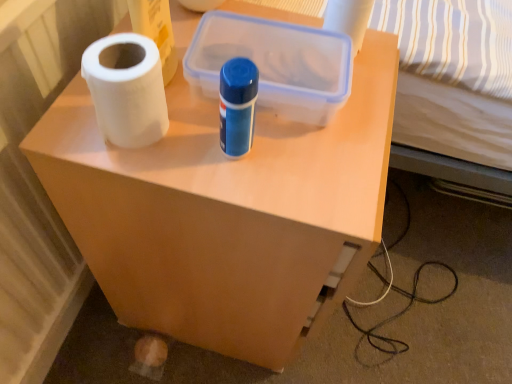
Locate an element on the screen. The height and width of the screenshot is (384, 512). transparent plastic storage box at center is located at coordinates (275, 64).

Consider the image. Measure the distance between matte plastic side table at center and camera.

matte plastic side table at center and camera are 18.47 inches apart.

The width and height of the screenshot is (512, 384). In order to click on white matte paper towel at left in this screenshot , I will do `click(126, 89)`.

What do you see at coordinates (126, 89) in the screenshot?
I see `white matte paper towel at left` at bounding box center [126, 89].

Find the location of `transparent plastic storage box at center`. transparent plastic storage box at center is located at coordinates (275, 64).

Is matte plastic side table at center at the back of white matte toilet paper at upper center?

white matte toilet paper at upper center does not have its back to matte plastic side table at center.

Based on their sizes in the image, would you say white matte toilet paper at upper center is bigger or smaller than matte plastic side table at center?

Considering their sizes, white matte toilet paper at upper center takes up less space than matte plastic side table at center.

Considering the positions of objects white matte toilet paper at upper center and matte plastic side table at center in the image provided, who is behind, white matte toilet paper at upper center or matte plastic side table at center?

white matte toilet paper at upper center is more distant.

Between point (354, 27) and point (359, 105), which one is positioned in front?

The point (359, 105) is closer.

From the image's perspective, would you say white matte paper towel at left is shown under white matte toilet paper at upper center?

Correct, white matte paper towel at left appears lower than white matte toilet paper at upper center in the image.

Could you tell me if white matte paper towel at left is turned towards white matte toilet paper at upper center?

No, white matte paper towel at left is not turned towards white matte toilet paper at upper center.

Between white matte paper towel at left and white matte toilet paper at upper center, which one has larger width?

Wider between the two is white matte paper towel at left.

How many degrees apart are the facing directions of white matte paper towel at left and white matte toilet paper at upper center?

white matte paper towel at left and white matte toilet paper at upper center are facing 0.00493 degrees away from each other.

Where is `storage box located above the white matte paper towel at left (from the image's perspective)`? This screenshot has height=384, width=512. storage box located above the white matte paper towel at left (from the image's perspective) is located at coordinates click(x=275, y=64).

Is transparent plastic storage box at center aimed at white matte paper towel at left?

No, transparent plastic storage box at center is not facing towards white matte paper towel at left.

Between transparent plastic storage box at center and white matte paper towel at left, which one appears on the right side from the viewer's perspective?

From the viewer's perspective, transparent plastic storage box at center appears more on the right side.

Is transparent plastic storage box at center in front of or behind white matte paper towel at left in the image?

Clearly, transparent plastic storage box at center is behind white matte paper towel at left.

From the image's perspective, is white matte paper towel at left positioned above or below transparent plastic storage box at center?

white matte paper towel at left is situated lower than transparent plastic storage box at center in the image.

Looking at this image, considering the sizes of white matte paper towel at left and transparent plastic storage box at center in the image, is white matte paper towel at left bigger or smaller than transparent plastic storage box at center?

Clearly, white matte paper towel at left is smaller in size than transparent plastic storage box at center.

Considering the points (111, 125) and (306, 89), which point is behind, point (111, 125) or point (306, 89)?

The point (306, 89) is farther.

Who is shorter, white matte paper towel at left or matte plastic side table at center?

white matte paper towel at left is shorter.

From a real-world perspective, who is located higher, white matte paper towel at left or matte plastic side table at center?

white matte paper towel at left, from a real-world perspective.

Does point (154, 56) lie in front of point (145, 274)?

Yes, point (154, 56) is closer to viewer.

From the image's perspective, which object appears higher, white matte paper towel at left or matte plastic side table at center?

From the image's view, white matte paper towel at left is above.

Which is more to the left, transparent plastic storage box at center or white matte toilet paper at upper center?

From the viewer's perspective, transparent plastic storage box at center appears more on the left side.

Which is nearer, (326, 56) or (327, 4)?

Point (326, 56) appears to be closer to the viewer than point (327, 4).

Could you measure the distance between transparent plastic storage box at center and white matte toilet paper at upper center?

The distance of transparent plastic storage box at center from white matte toilet paper at upper center is 10.78 centimeters.

What's the angular difference between transparent plastic storage box at center and white matte toilet paper at upper center's facing directions?

transparent plastic storage box at center and white matte toilet paper at upper center are facing 6.05 degrees away from each other.

From a real-world perspective, is matte plastic side table at center physically below white matte paper towel at left?

Indeed, from a real-world perspective, matte plastic side table at center is positioned beneath white matte paper towel at left.

Is white matte paper towel at left located within matte plastic side table at center?

No, white matte paper towel at left is located outside of matte plastic side table at center.

Between matte plastic side table at center and white matte paper towel at left, which one has smaller width?

white matte paper towel at left.

From the image's perspective, which one is positioned lower, matte plastic side table at center or white matte paper towel at left?

matte plastic side table at center is shown below in the image.

At what (x,y) coordinates should I click in order to perform the action: click on toilet paper that is above the matte plastic side table at center (from the image's perspective). Please return your answer as a coordinate pair (x, y). The image size is (512, 384). Looking at the image, I should click on (348, 19).

Where is `toilet paper located behind the white matte paper towel at left`? The width and height of the screenshot is (512, 384). toilet paper located behind the white matte paper towel at left is located at coordinates (348, 19).

In the scene shown: When comparing their distances from matte plastic side table at center, does transparent plastic storage box at center or white matte paper towel at left seem closer?

Among the two, transparent plastic storage box at center is located nearer to matte plastic side table at center.

When comparing their distances from matte plastic side table at center, does transparent plastic storage box at center or white matte toilet paper at upper center seem further?

Among the two, white matte toilet paper at upper center is located further to matte plastic side table at center.

From the image, which object appears to be nearer to transparent plastic storage box at center, white matte paper towel at left or white matte toilet paper at upper center?

white matte toilet paper at upper center is positioned closer to the anchor transparent plastic storage box at center.

Consider the image. Which object lies nearer to the anchor point white matte toilet paper at upper center, transparent plastic storage box at center or matte plastic side table at center?

transparent plastic storage box at center is positioned closer to the anchor white matte toilet paper at upper center.

Considering their positions, is white matte paper towel at left positioned further to matte plastic side table at center than white matte toilet paper at upper center?

white matte toilet paper at upper center lies further to matte plastic side table at center than the other object.

Which object lies nearer to the anchor point matte plastic side table at center, white matte toilet paper at upper center or white matte paper towel at left?

Based on the image, white matte paper towel at left appears to be nearer to matte plastic side table at center.

Which object lies further to the anchor point transparent plastic storage box at center, white matte toilet paper at upper center or white matte paper towel at left?

white matte paper towel at left is further to transparent plastic storage box at center.

When comparing their distances from white matte paper towel at left, does matte plastic side table at center or white matte toilet paper at upper center seem further?

Based on the image, white matte toilet paper at upper center appears to be further to white matte paper towel at left.

Identify the location of paper towel between transparent plastic storage box at center and matte plastic side table at center from top to bottom. The image size is (512, 384). (126, 89).

The height and width of the screenshot is (384, 512). Identify the location of storage box between white matte paper towel at left and white matte toilet paper at upper center. (275, 64).

The height and width of the screenshot is (384, 512). Find the location of `paper towel that lies between white matte toilet paper at upper center and matte plastic side table at center from top to bottom`. paper towel that lies between white matte toilet paper at upper center and matte plastic side table at center from top to bottom is located at coordinates (126, 89).

Where is `storage box between white matte toilet paper at upper center and matte plastic side table at center vertically`? storage box between white matte toilet paper at upper center and matte plastic side table at center vertically is located at coordinates (275, 64).